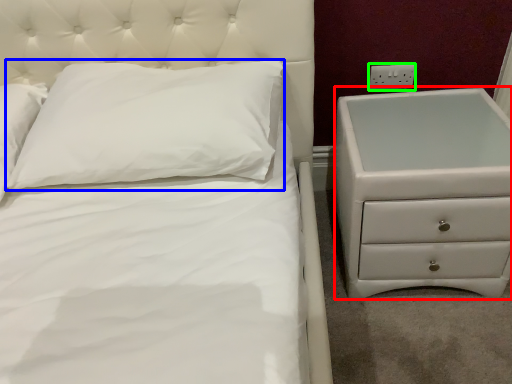
Question: Considering the real-world distances, which object is farthest from chest of drawers (highlighted by a red box)? pillow (highlighted by a blue box) or electric outlet (highlighted by a green box)?

Choices:
 (A) pillow
 (B) electric outlet

Answer: (A)